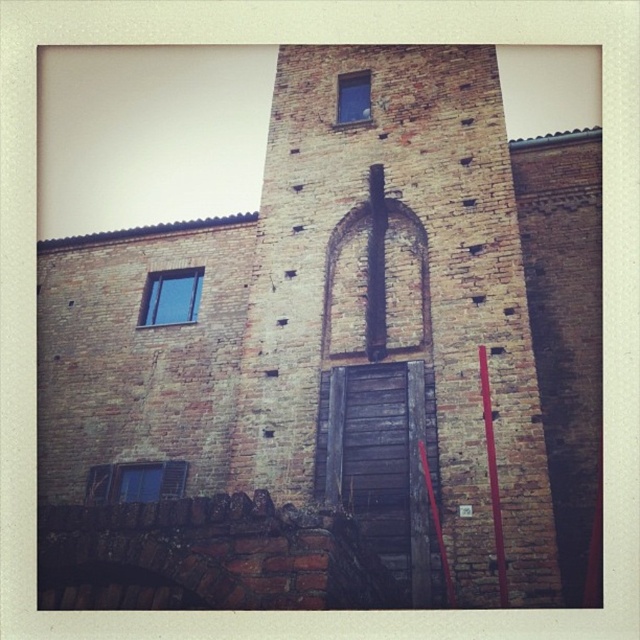
You are an architect examining the aged brick building. You notice the wooden window frame at lower left and the blue glass window at upper center. Which window has a greater height?

The blue glass window at upper center is taller than the wooden window frame at lower left, so it has a greater height.

You are an architect inspecting the building. You need to compare the widths of the wooden window frame at lower left and the blue glass window at upper center. Which one is wider?

The wooden window frame at lower left is wider than the blue glass window at upper center.